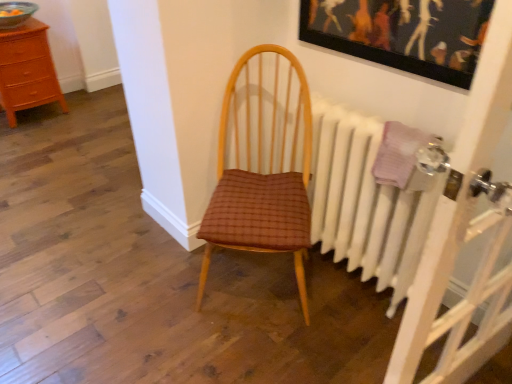
Question: From the image's perspective, does brown woven fabric chair at center appear lower than white painted radiator at right?

Choices:
 (A) no
 (B) yes

Answer: (A)

Question: Can you confirm if brown woven fabric chair at center is bigger than white painted radiator at right?

Choices:
 (A) no
 (B) yes

Answer: (B)

Question: From a real-world perspective, is brown woven fabric chair at center located higher than white painted radiator at right?

Choices:
 (A) yes
 (B) no

Answer: (A)

Question: From the image's perspective, would you say brown woven fabric chair at center is positioned over white painted radiator at right?

Choices:
 (A) yes
 (B) no

Answer: (A)

Question: Does brown woven fabric chair at center touch white painted radiator at right?

Choices:
 (A) yes
 (B) no

Answer: (B)

Question: From the image's perspective, is white painted radiator at right above or below wooden picture frame at upper center?

Choices:
 (A) above
 (B) below

Answer: (B)

Question: Is white painted radiator at right bigger or smaller than wooden picture frame at upper center?

Choices:
 (A) small
 (B) big

Answer: (B)

Question: In the image, is white painted radiator at right on the left side or the right side of wooden picture frame at upper center?

Choices:
 (A) right
 (B) left

Answer: (B)

Question: From a real-world perspective, is white painted radiator at right physically located above or below wooden picture frame at upper center?

Choices:
 (A) above
 (B) below

Answer: (B)

Question: From a real-world perspective, is wooden picture frame at upper center positioned above or below white painted radiator at right?

Choices:
 (A) below
 (B) above

Answer: (B)

Question: From the image's perspective, is wooden picture frame at upper center above or below white painted radiator at right?

Choices:
 (A) above
 (B) below

Answer: (A)

Question: Is wooden picture frame at upper center wider or thinner than white painted radiator at right?

Choices:
 (A) wide
 (B) thin

Answer: (B)

Question: Considering their positions, is wooden picture frame at upper center located in front of or behind white painted radiator at right?

Choices:
 (A) behind
 (B) front

Answer: (B)

Question: Would you say wooden chest of drawers at left is inside or outside white painted radiator at right?

Choices:
 (A) inside
 (B) outside

Answer: (B)

Question: Is point (9, 104) positioned closer to the camera than point (342, 109)?

Choices:
 (A) farther
 (B) closer

Answer: (A)